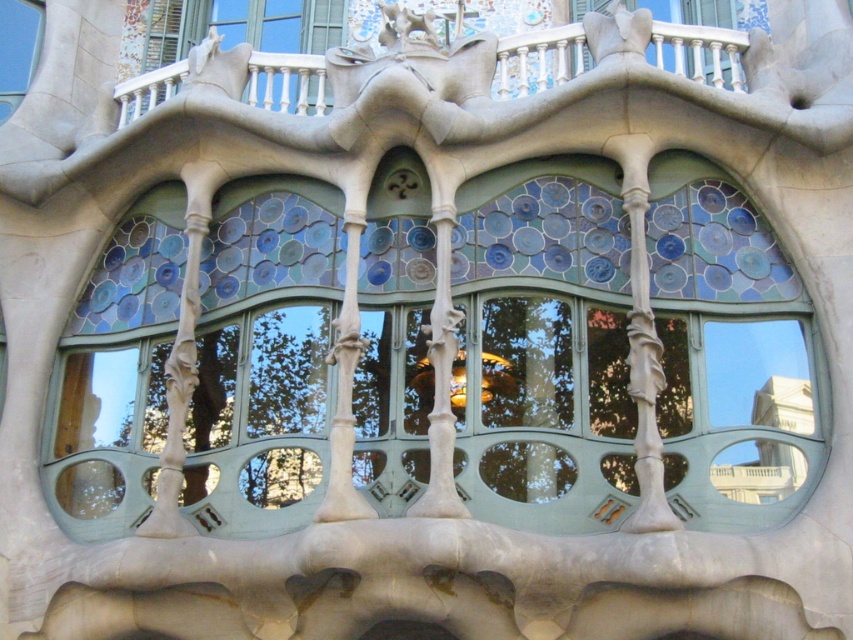
Is blue mosaic glass at center further to the viewer compared to smooth stone balcony at upper center?

No, blue mosaic glass at center is in front of smooth stone balcony at upper center.

Between blue mosaic glass at center and smooth stone balcony at upper center, which one is positioned lower?

blue mosaic glass at center

Who is more distant from viewer, [367,385] or [248,86]?

Point [248,86]

Image resolution: width=853 pixels, height=640 pixels. I want to click on blue mosaic glass at center, so click(544, 355).

Does smooth stone balcony at upper center have a lesser width compared to stained glass window at upper left?

In fact, smooth stone balcony at upper center might be wider than stained glass window at upper left.

Is smooth stone balcony at upper center bigger than stained glass window at upper left?

Indeed, smooth stone balcony at upper center has a larger size compared to stained glass window at upper left.

Between point (521, 51) and point (30, 3), which one is positioned in front?

Point (521, 51) is in front.

You are a GUI agent. You are given a task and a screenshot of the screen. Output one action in this format:
    pyautogui.click(x=<x>, y=<y>)
    Task: Click on the smooth stone balcony at upper center
    This screenshot has width=853, height=640.
    Given the screenshot: What is the action you would take?
    [538, 60]

Is blue mosaic glass at center taller than stained glass window at upper left?

Indeed, blue mosaic glass at center has a greater height compared to stained glass window at upper left.

Which is behind, point (572, 300) or point (28, 13)?

Point (28, 13)

The width and height of the screenshot is (853, 640). I want to click on blue mosaic glass at center, so click(x=544, y=355).